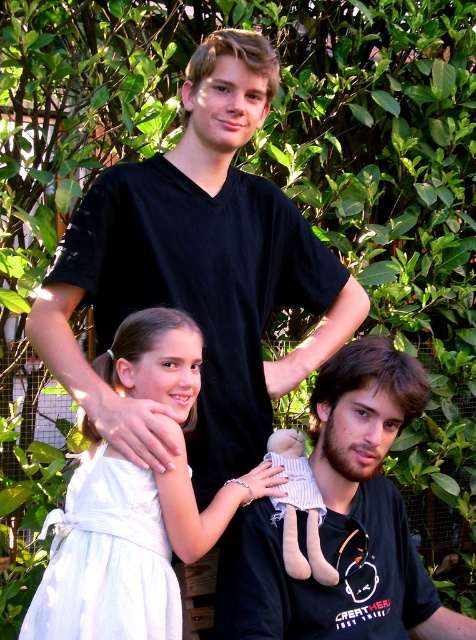
Question: Among these points, which one is farthest from the camera?

Choices:
 (A) (196, 545)
 (B) (317, 628)
 (C) (283, 506)

Answer: (C)

Question: From the image, what is the correct spatial relationship of matte black shirt at center in relation to white cotton dress at center?

Choices:
 (A) above
 (B) below

Answer: (B)

Question: Which point is farther to the camera?

Choices:
 (A) (146, 308)
 (B) (258, 513)

Answer: (B)

Question: Which object is closer to the camera taking this photo?

Choices:
 (A) matte black shirt at center
 (B) white cotton dress at center
 (C) soft beige fabric doll at lower center

Answer: (B)

Question: Is white cotton dress at center positioned in front of soft beige fabric doll at lower center?

Choices:
 (A) yes
 (B) no

Answer: (A)

Question: Does matte black shirt at center appear on the right side of white cotton dress at center?

Choices:
 (A) no
 (B) yes

Answer: (B)